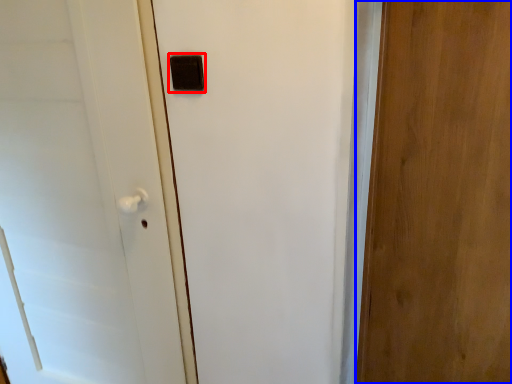
Question: Among these objects, which one is nearest to the camera, light switch (highlighted by a red box) or door (highlighted by a blue box)?

Choices:
 (A) light switch
 (B) door

Answer: (B)